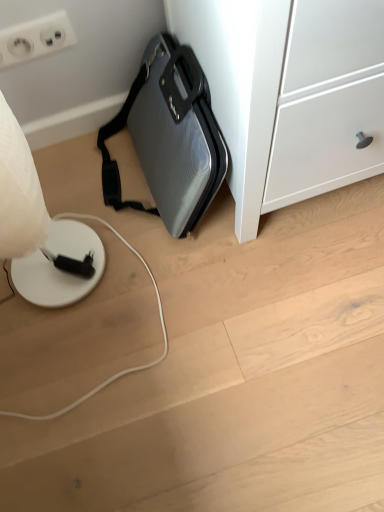
Where is `white plastic socket at upper left`? white plastic socket at upper left is located at coordinates (35, 38).

What do you see at coordinates (35, 38) in the screenshot?
I see `white plastic socket at upper left` at bounding box center [35, 38].

Locate an element on the screen. Image resolution: width=384 pixels, height=512 pixels. white plastic socket at upper left is located at coordinates (35, 38).